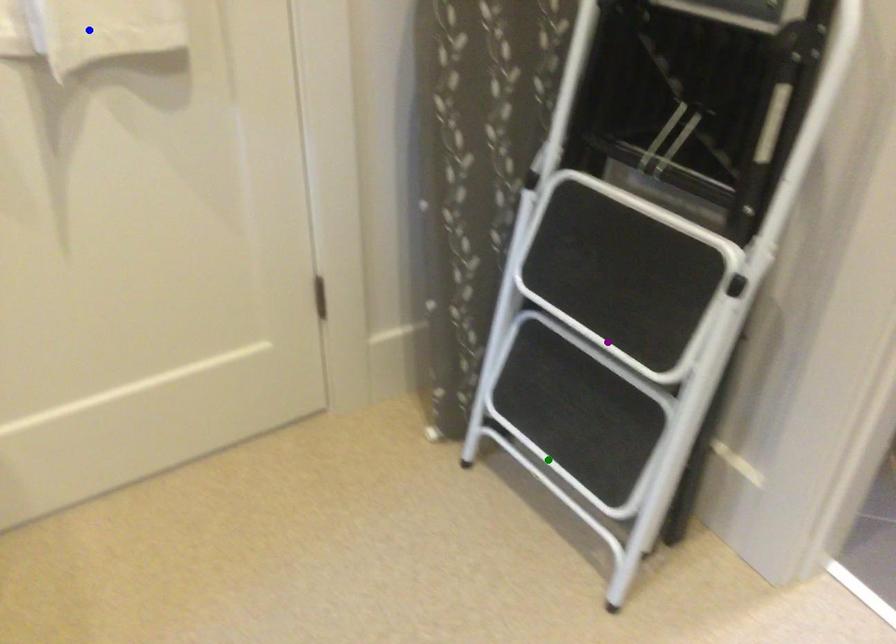
Order these from nearest to farthest:
green point, blue point, purple point

blue point < purple point < green point